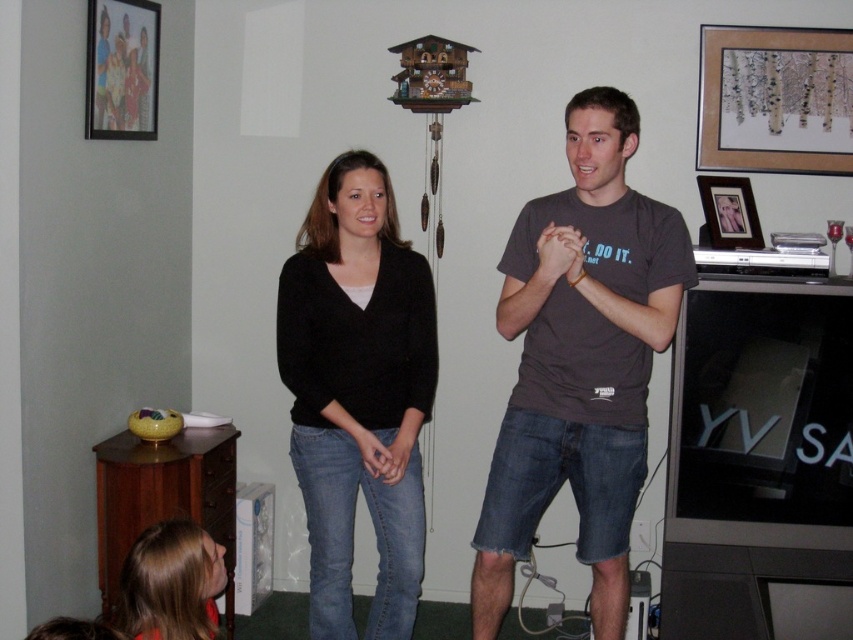
You are a guest in this living room and want to place a small gift on the nearest available surface. The black sweater at center and the matte brown picture frame at upper right are both in your line of sight. Which object should you choose to place the gift on?

You should place the gift on the black sweater at center because it is closer to you than the matte brown picture frame at upper right, which is further away.

You are standing in the living room and want to place a new picture frame on the wall. The existing picture frame at point (775, 99) is already there. Where exactly is the existing picture frame located?

The existing picture frame at point (775, 99) is located at the upper right corner of the wall.